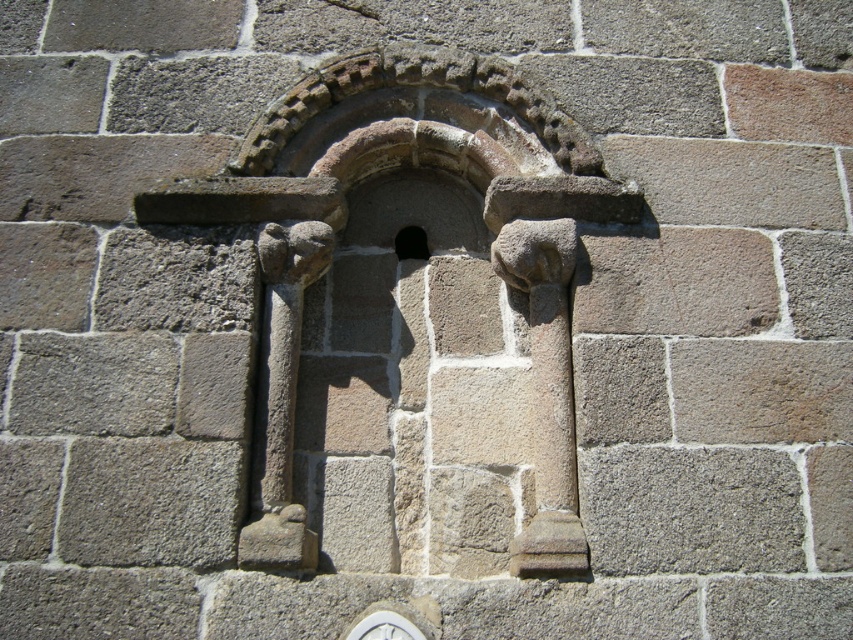
You are standing in front of the stone wall and notice two points marked on it. The first point is at coordinates point [375,88] and the second at point [416,228]. Which point is closer to you?

Point [375,88] is in front of point [416,228], so the first point is closer to you.

You are an architect examining the stone wall. You notice the rustic stone arch at center and the black stone window at center. Based on their positions, which one is located higher up on the wall?

The black stone window at center is located higher up on the wall because the rustic stone arch at center is below it.